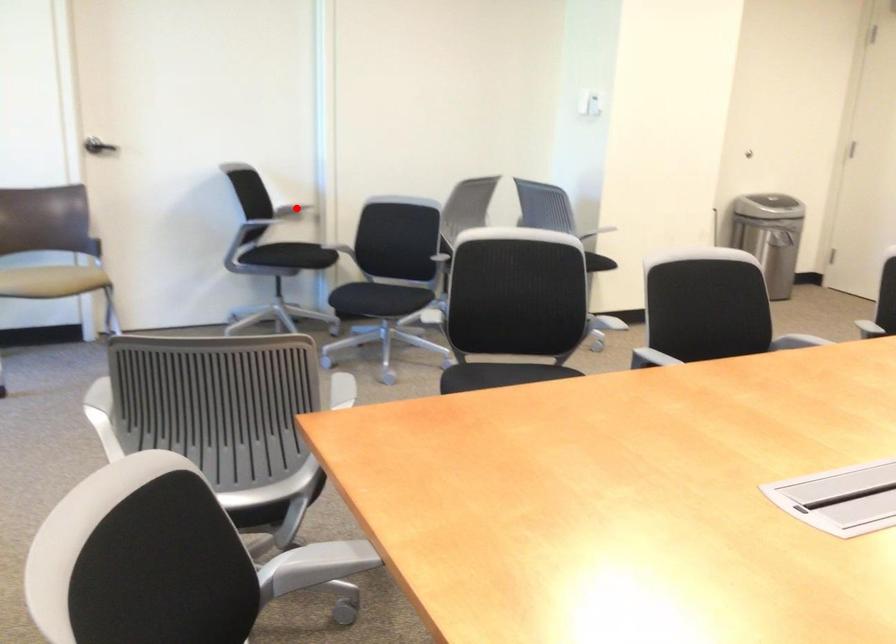
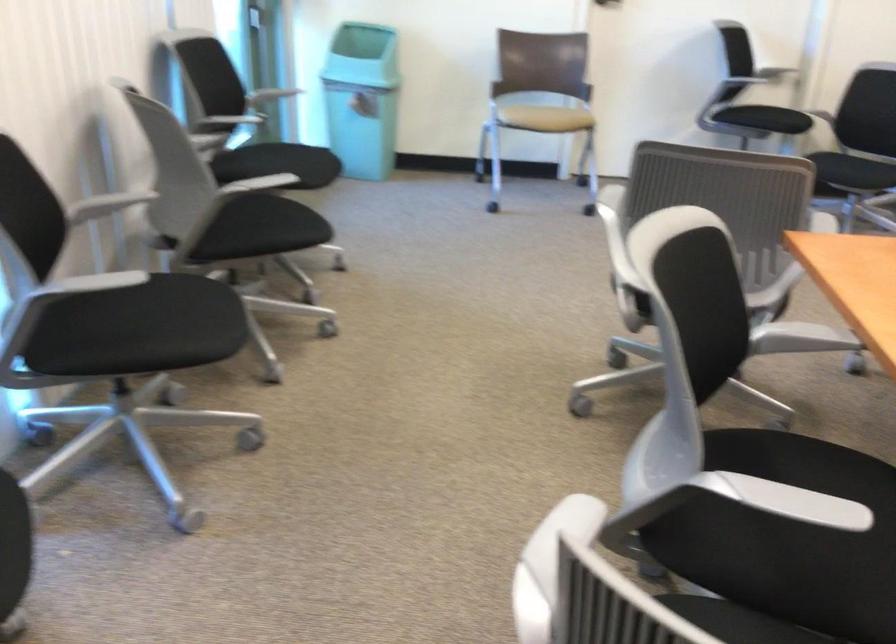
Question: I am providing you with two images of the same scene from different viewpoints. A red point is marked on the first image. At the location where the point appears in image 1, is it still visible in image 2?

Choices:
 (A) Yes
 (B) No

Answer: (B)